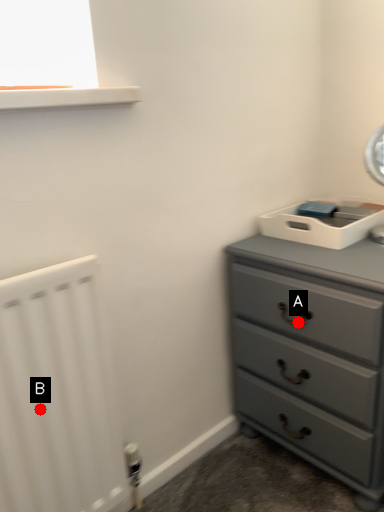
Question: Two points are circled on the image, labeled by A and B beside each circle. Which point is further to the camera?

Choices:
 (A) A is further
 (B) B is further

Answer: (A)